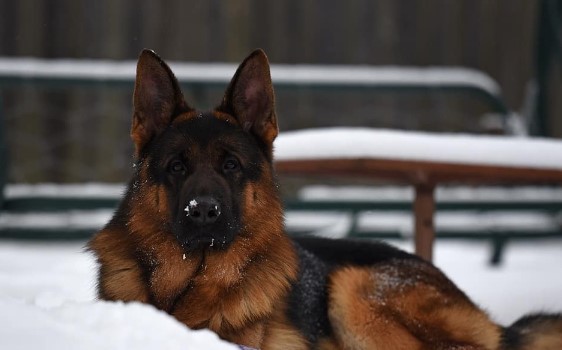
The image size is (562, 350). Find the location of `wall`. wall is located at coordinates (332, 37).